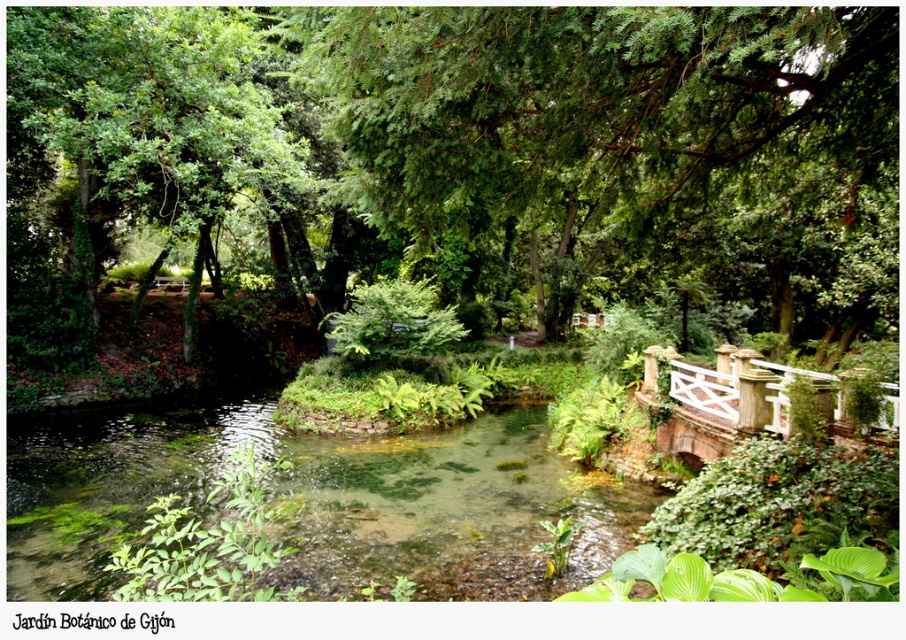
You are standing in the botanical garden and want to take a photo of both the point at coordinates (x=602, y=264) and the point at coordinates (x=76, y=170). Which point should you focus on first to ensure both are in focus?

You should focus on the point at coordinates (x=602, y=264) first because it is closer to the camera than the point at coordinates (x=76, y=170). This ensures the closer point is in focus, and the farther point will also be within the depth of field.

You are a visitor at the botanical garden and want to cross the white wooden bridge at right. However, you notice the green leafy tree at center blocking your path. Can you walk around the tree to reach the bridge?

The green leafy tree at center is in front of the white wooden bridge at right, so you can walk around the tree to reach the bridge as long as there is a clear path around it.